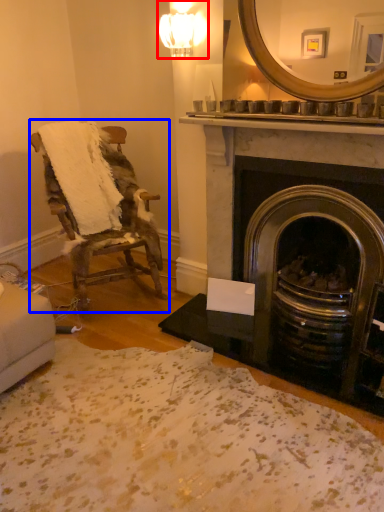
Question: Which object appears closest to the camera in this image, light fixture (highlighted by a red box) or chair (highlighted by a blue box)?

Choices:
 (A) light fixture
 (B) chair

Answer: (B)